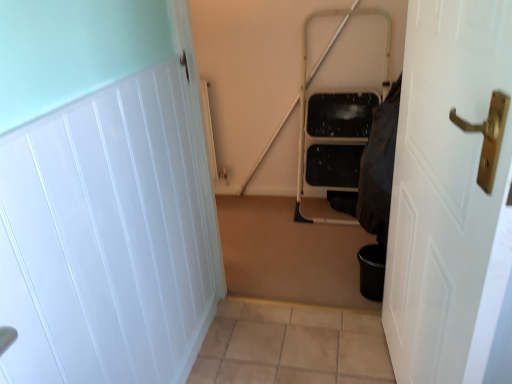
Question: Is point (385, 327) positioned closer to the camera than point (197, 185)?

Choices:
 (A) farther
 (B) closer

Answer: (A)

Question: Is white glossy door at right, marked as the second door in a left-to-right arrangement, situated inside white glossy door at left, marked as the 1th door in a left-to-right arrangement, or outside?

Choices:
 (A) inside
 (B) outside

Answer: (B)

Question: Which object is the closest to the white glossy door at left, marked as the 1th door in a left-to-right arrangement?

Choices:
 (A) white glossy door at right, marked as the second door in a left-to-right arrangement
 (B) black fabric at right

Answer: (A)

Question: Considering the real-world distances, which object is closest to the black fabric at right?

Choices:
 (A) white glossy door at right, marked as the second door in a left-to-right arrangement
 (B) white glossy door at left, which is the second door in right-to-left order

Answer: (A)